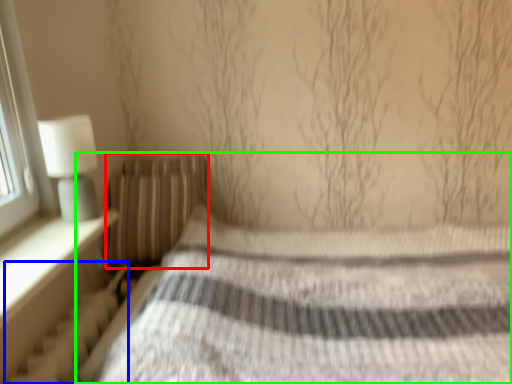
Question: Which object is positioned closest to pillow (highlighted by a red box)? Select from radiator (highlighted by a blue box) and bed (highlighted by a green box).

Choices:
 (A) radiator
 (B) bed

Answer: (A)